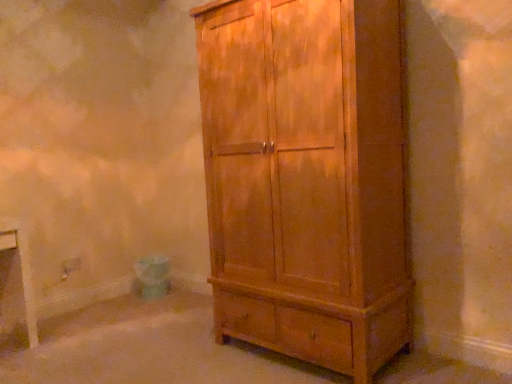
The image size is (512, 384). Find the location of `wooden wardrobe at center`. wooden wardrobe at center is located at coordinates (306, 178).

What do you see at coordinates (306, 178) in the screenshot? I see `wooden wardrobe at center` at bounding box center [306, 178].

This screenshot has height=384, width=512. What are the coordinates of `wooden wardrobe at center` in the screenshot? It's located at (306, 178).